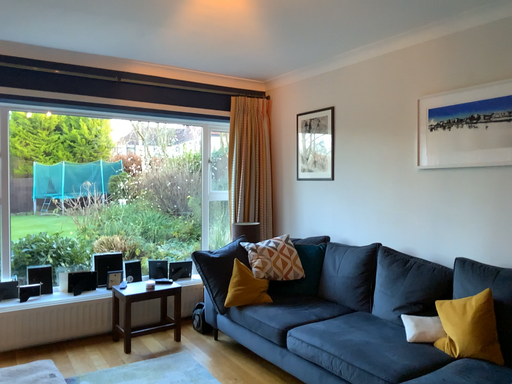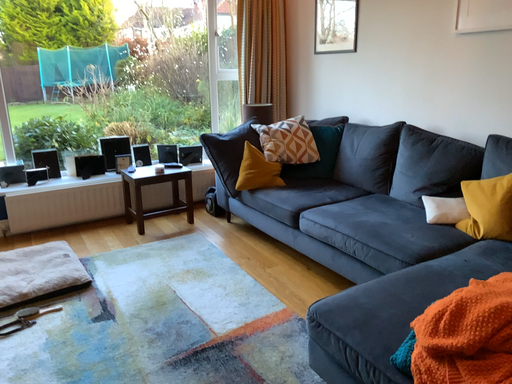
Question: How did the camera likely rotate when shooting the video?

Choices:
 (A) rotated downward
 (B) rotated upward

Answer: (A)